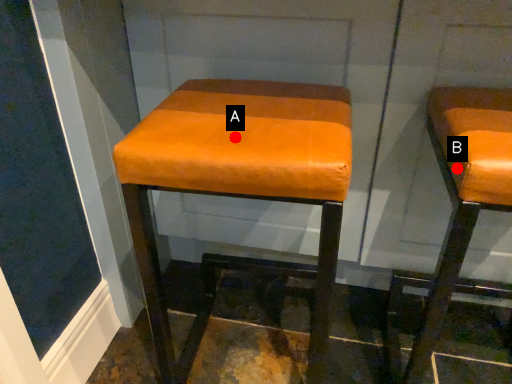
Question: Two points are circled on the image, labeled by A and B beside each circle. Which point is farther from the camera taking this photo?

Choices:
 (A) A is further
 (B) B is further

Answer: (A)